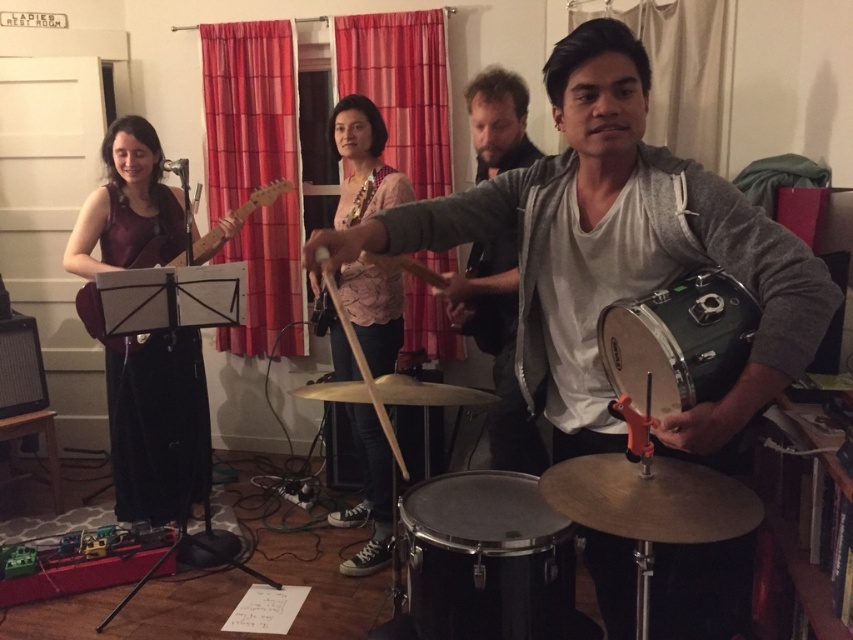
Question: Is green drum at center behind matte pink shirt at center?

Choices:
 (A) no
 (B) yes

Answer: (A)

Question: Based on their relative distances, which object is farther from the green metallic drum at center?

Choices:
 (A) gray fabric jacket at center
 (B) matte wood guitar at left
 (C) green drum at center

Answer: (B)

Question: Can you confirm if gray fabric jacket at center is wider than green metallic drum at center?

Choices:
 (A) no
 (B) yes

Answer: (B)

Question: Considering the real-world distances, which object is closest to the matte pink shirt at center?

Choices:
 (A) green metallic drum at center
 (B) matte purple guitar at left
 (C) green drum at center
 (D) matte wood guitar at left

Answer: (D)

Question: Can you confirm if green drum at center is wider than matte pink shirt at center?

Choices:
 (A) no
 (B) yes

Answer: (B)

Question: Among these points, which one is nearest to the camera?

Choices:
 (A) (195, 260)
 (B) (85, 296)
 (C) (610, 264)

Answer: (C)